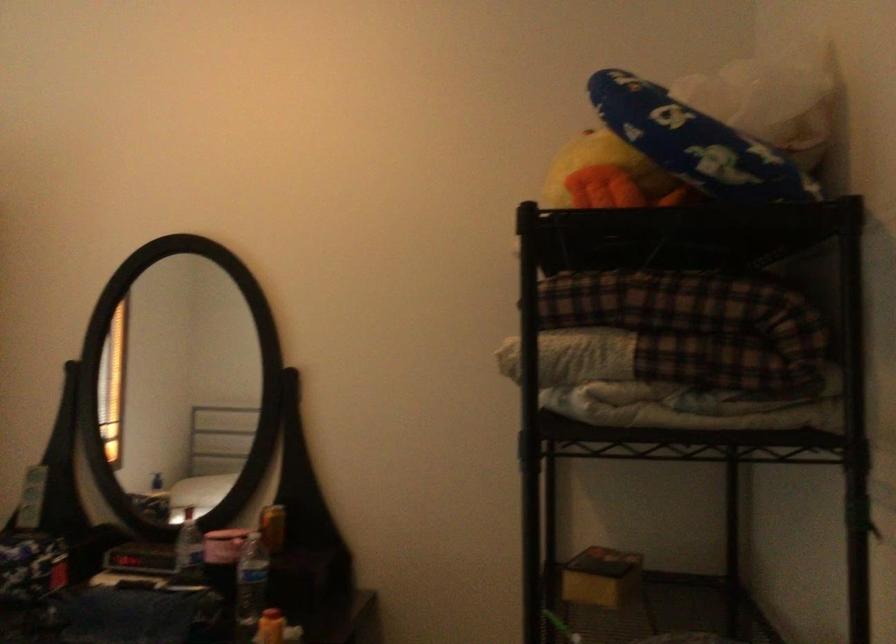
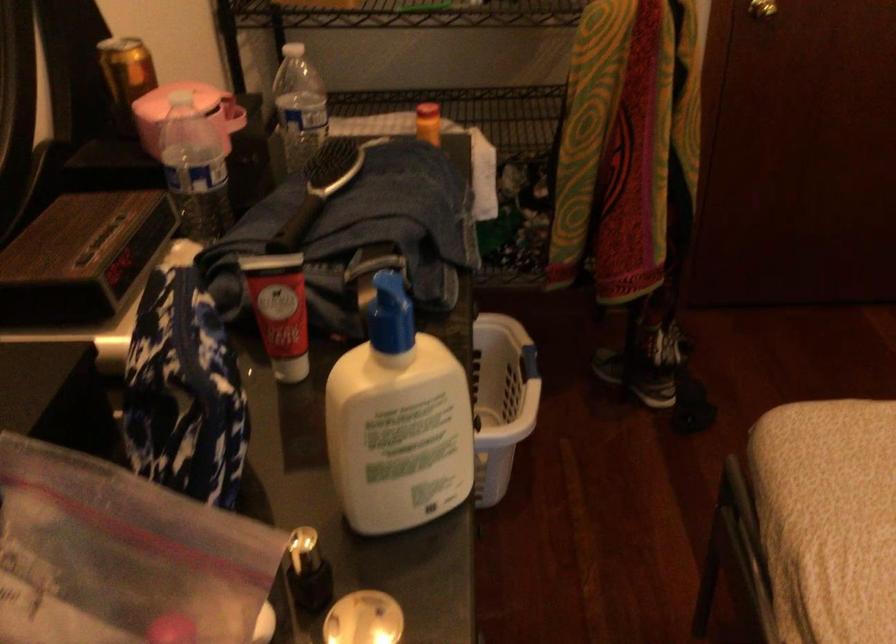
Find the pixel in the second image that matches (x=268, y=522) in the first image.

(125, 76)